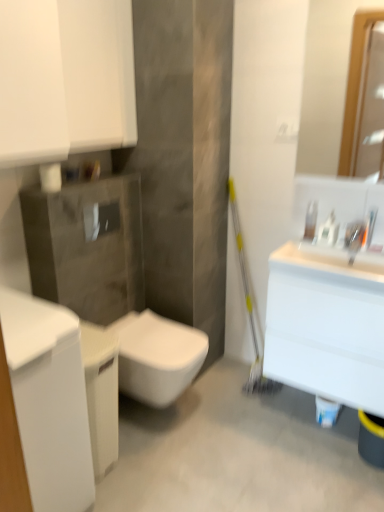
Question: Is white glossy cabinet at left surrounding matte wooden mirror at upper right?

Choices:
 (A) no
 (B) yes

Answer: (A)

Question: From the image's perspective, is white glossy cabinet at left on top of matte wooden mirror at upper right?

Choices:
 (A) yes
 (B) no

Answer: (B)

Question: Is white glossy cabinet at left far from matte wooden mirror at upper right?

Choices:
 (A) yes
 (B) no

Answer: (A)

Question: Considering the relative sizes of white glossy cabinet at left and matte wooden mirror at upper right in the image provided, is white glossy cabinet at left smaller than matte wooden mirror at upper right?

Choices:
 (A) no
 (B) yes

Answer: (A)

Question: From a real-world perspective, is white glossy cabinet at left over matte wooden mirror at upper right?

Choices:
 (A) no
 (B) yes

Answer: (A)

Question: Is white glossy cabinet at left bigger than matte wooden mirror at upper right?

Choices:
 (A) yes
 (B) no

Answer: (A)

Question: Is satin nickel faucet at upper right outside clear plastic soap dispenser at upper right?

Choices:
 (A) yes
 (B) no

Answer: (A)

Question: Does satin nickel faucet at upper right lie behind clear plastic soap dispenser at upper right?

Choices:
 (A) yes
 (B) no

Answer: (B)

Question: Are satin nickel faucet at upper right and clear plastic soap dispenser at upper right beside each other?

Choices:
 (A) yes
 (B) no

Answer: (B)

Question: From the image's perspective, would you say satin nickel faucet at upper right is positioned over clear plastic soap dispenser at upper right?

Choices:
 (A) yes
 (B) no

Answer: (B)

Question: Is satin nickel faucet at upper right closer to the viewer compared to clear plastic soap dispenser at upper right?

Choices:
 (A) no
 (B) yes

Answer: (B)

Question: From a real-world perspective, does satin nickel faucet at upper right sit lower than clear plastic soap dispenser at upper right?

Choices:
 (A) yes
 (B) no

Answer: (A)

Question: Does white glossy bottle at upper right have a greater height compared to white glossy cabinet at left?

Choices:
 (A) yes
 (B) no

Answer: (B)